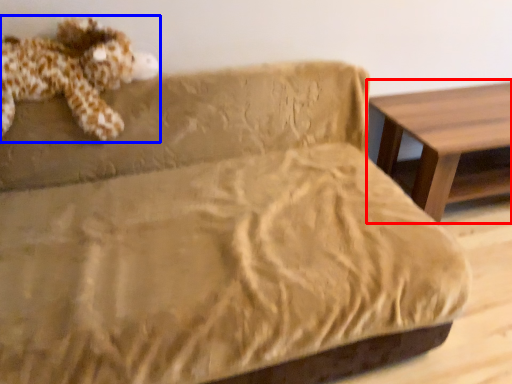
Question: Which object is closer to the camera taking this photo, table (highlighted by a red box) or toy (highlighted by a blue box)?

Choices:
 (A) table
 (B) toy

Answer: (B)